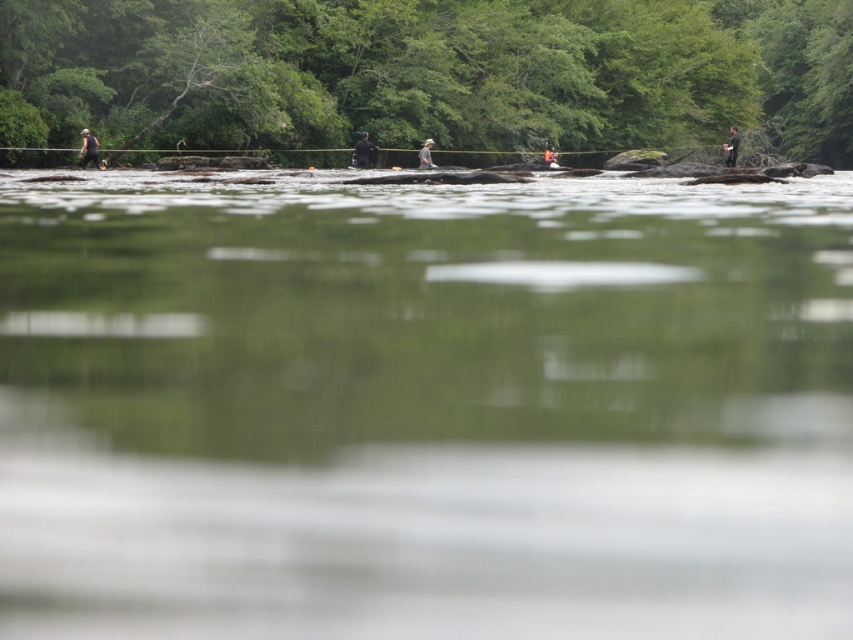
Is point (781, 397) positioned in front of point (422, 168)?

Yes, it is in front of point (422, 168).

Is green smooth water at center below dark gray fabric jacket at center?

Yes, green smooth water at center is below dark gray fabric jacket at center.

What do you see at coordinates (424, 406) in the screenshot?
I see `green smooth water at center` at bounding box center [424, 406].

Image resolution: width=853 pixels, height=640 pixels. Identify the location of green smooth water at center. (424, 406).

Who is more distant from viewer, [416,426] or [363,163]?

The point [363,163] is behind.

Locate an element on the screen. green smooth water at center is located at coordinates (424, 406).

Locate an element on the screen. green smooth water at center is located at coordinates (424, 406).

The height and width of the screenshot is (640, 853). I want to click on green smooth water at center, so click(424, 406).

Who is positioned more to the left, green smooth water at center or black matte jacket at upper right?

green smooth water at center

Is point (102, 280) farther from camera compared to point (729, 141)?

No, it is in front of (729, 141).

At what (x,y) coordinates should I click in order to perform the action: click on green smooth water at center. Please return your answer as a coordinate pair (x, y). The image size is (853, 640). Looking at the image, I should click on (424, 406).